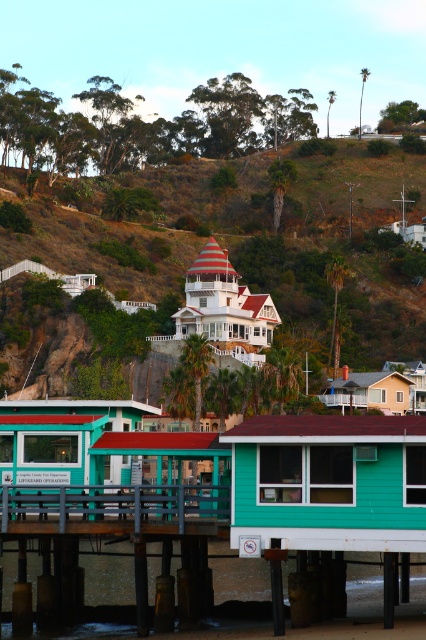
Between teal wood cabin at lower center and teal wood cabin at center, which one has more height?

With more height is teal wood cabin at lower center.

The height and width of the screenshot is (640, 426). I want to click on teal wood cabin at lower center, so click(x=330, y=481).

Where is `teal wood cabin at lower center`? The height and width of the screenshot is (640, 426). teal wood cabin at lower center is located at coordinates (330, 481).

Can you confirm if teal wood cabin at center is bigger than light brown wooden house at center?

Indeed, teal wood cabin at center has a larger size compared to light brown wooden house at center.

Which is more to the left, teal wood cabin at center or light brown wooden house at center?

teal wood cabin at center is more to the left.

Locate an element on the screen. teal wood cabin at center is located at coordinates (66, 444).

Does teal wood cabin at lower center appear on the left side of light brown wooden house at center?

Indeed, teal wood cabin at lower center is positioned on the left side of light brown wooden house at center.

Find the location of `teal wood cabin at lower center`. teal wood cabin at lower center is located at coordinates (330, 481).

Where is `teal wood cabin at lower center`? The height and width of the screenshot is (640, 426). teal wood cabin at lower center is located at coordinates (330, 481).